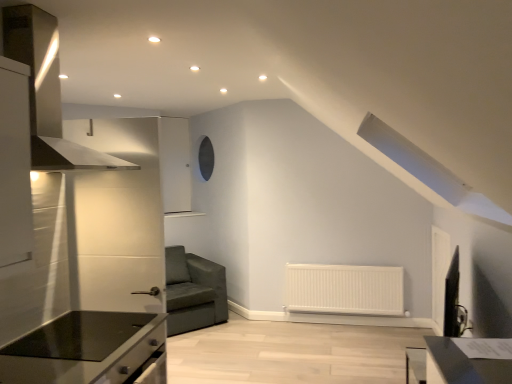
Question: Considering the relative positions of black glass countertop at lower left and white matte radiator at lower center in the image provided, is black glass countertop at lower left behind white matte radiator at lower center?

Choices:
 (A) yes
 (B) no

Answer: (B)

Question: Is white matte radiator at lower center completely or partially inside black glass countertop at lower left?

Choices:
 (A) yes
 (B) no

Answer: (B)

Question: Does black glass countertop at lower left have a lesser height compared to white matte radiator at lower center?

Choices:
 (A) yes
 (B) no

Answer: (A)

Question: Does black glass countertop at lower left have a smaller size compared to white matte radiator at lower center?

Choices:
 (A) no
 (B) yes

Answer: (B)

Question: From a real-world perspective, is black glass countertop at lower left positioned over white matte radiator at lower center based on gravity?

Choices:
 (A) yes
 (B) no

Answer: (A)

Question: Is the depth of black glass countertop at lower left less than that of white matte radiator at lower center?

Choices:
 (A) yes
 (B) no

Answer: (A)

Question: Is the depth of black glass countertop at lower left less than that of stainless steel exhaust hood at left?

Choices:
 (A) yes
 (B) no

Answer: (B)

Question: From the image's perspective, is black glass countertop at lower left over stainless steel exhaust hood at left?

Choices:
 (A) yes
 (B) no

Answer: (B)

Question: From a real-world perspective, is black glass countertop at lower left under stainless steel exhaust hood at left?

Choices:
 (A) yes
 (B) no

Answer: (A)

Question: From a real-world perspective, is black glass countertop at lower left on top of stainless steel exhaust hood at left?

Choices:
 (A) yes
 (B) no

Answer: (B)

Question: Does black glass countertop at lower left have a greater width compared to stainless steel exhaust hood at left?

Choices:
 (A) yes
 (B) no

Answer: (A)

Question: Is black glass countertop at lower left to the left of stainless steel exhaust hood at left from the viewer's perspective?

Choices:
 (A) no
 (B) yes

Answer: (A)

Question: From a real-world perspective, is white matte radiator at lower center positioned under black glass countertop at lower left based on gravity?

Choices:
 (A) yes
 (B) no

Answer: (A)